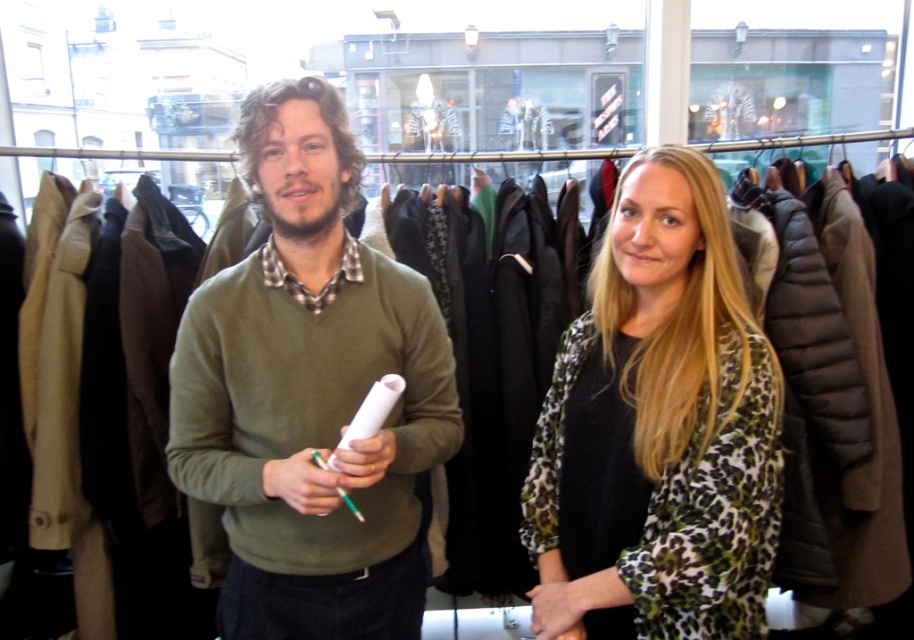
Is green matte sweater at center closer to camera compared to leopard print blouse at center?

Yes, green matte sweater at center is closer to the viewer.

Does point (381, 273) come in front of point (684, 358)?

No, it is not.

Locate an element on the screen. This screenshot has width=914, height=640. green matte sweater at center is located at coordinates pyautogui.click(x=310, y=394).